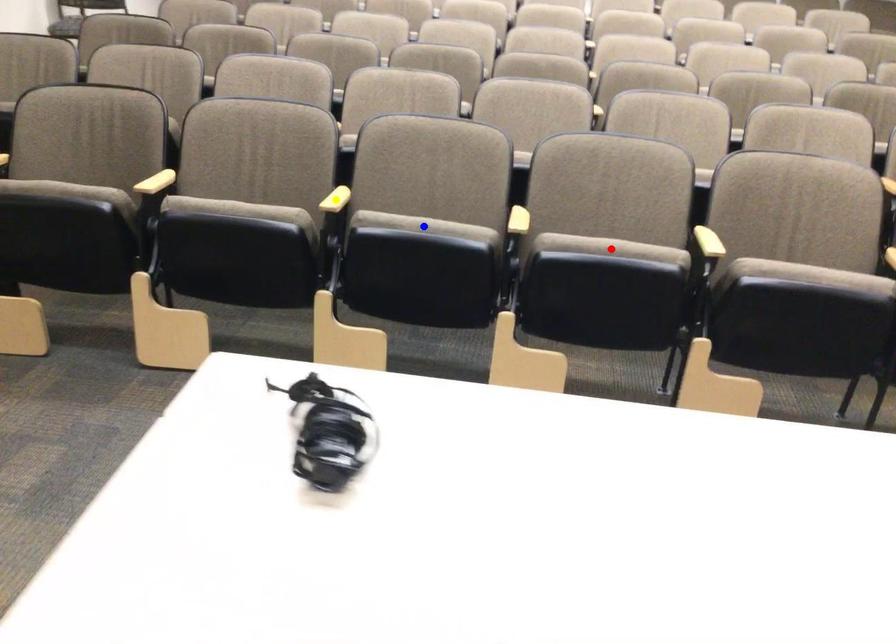
Order these from farthest to nearest:
- blue point
- yellow point
- red point

yellow point, blue point, red point